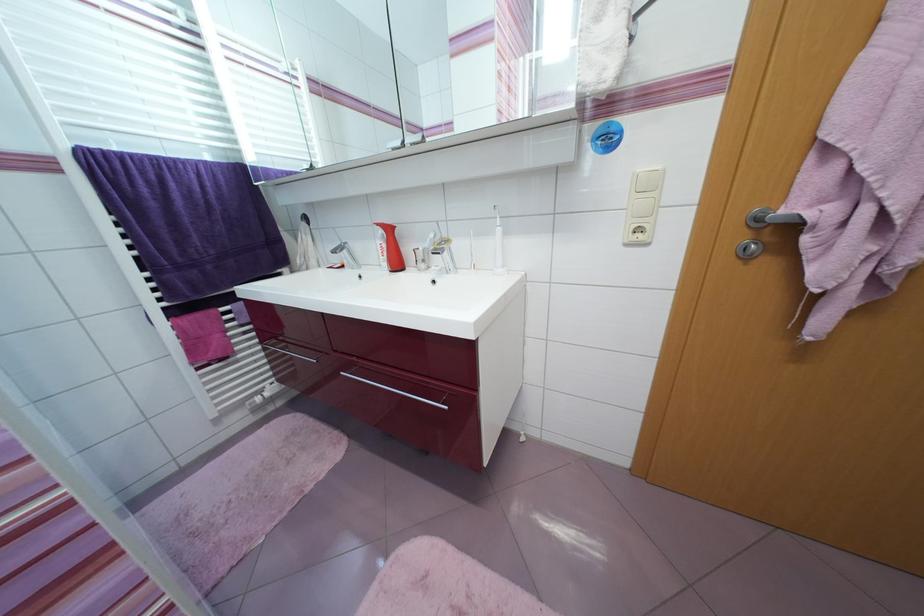
Describe the element at coordinates (395, 391) in the screenshot. I see `a metal drawer handle` at that location.